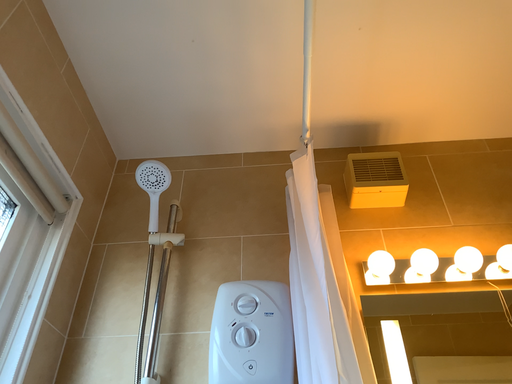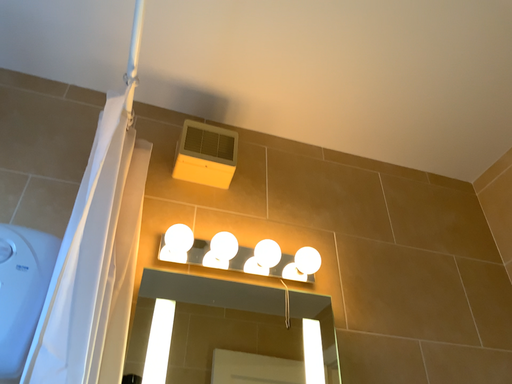
Question: Which way did the camera rotate in the video?

Choices:
 (A) rotated left
 (B) rotated right

Answer: (B)